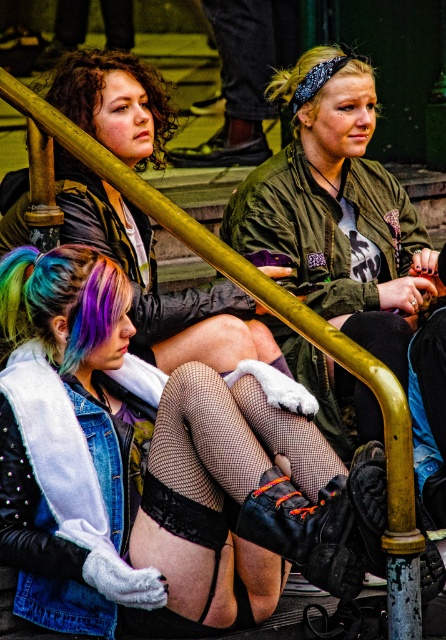
Based on the scene described, which individual has a shorter hair length between the rainbow dyed hair at lower left and the blondehair at upper center?

The rainbow dyed hair at lower left is shorter than the blondehair at upper center.

You are an artist trying to sketch this scene. You need to decide which object to draw first based on their sizes. Since the denim vest at center is wider than the suede boot at lower center, which object should you focus on first to ensure proper spatial arrangement?

The denim vest at center should be drawn first because it is wider than the suede boot at lower center, ensuring the spatial arrangement is accurate.